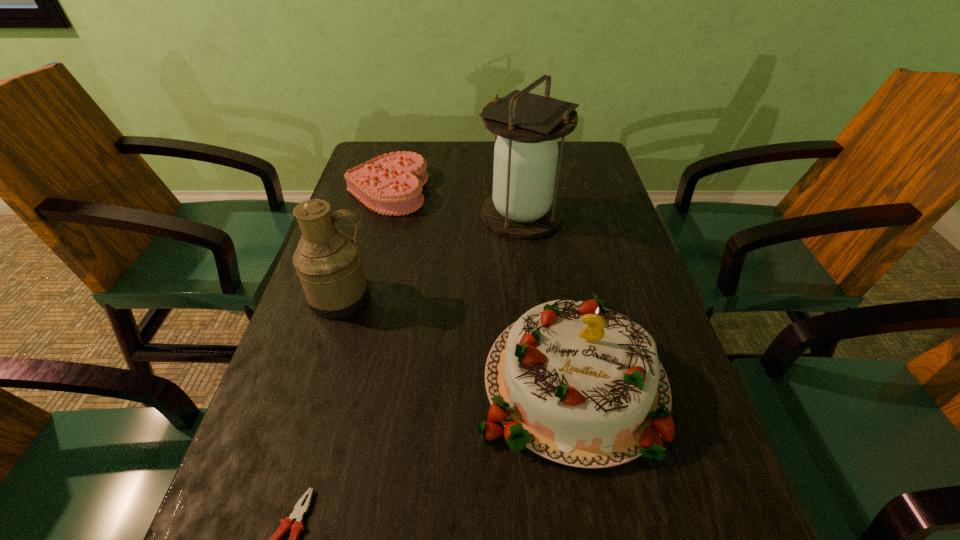
Find the location of a particular element. This screenshot has width=960, height=540. vacant area between the fourth tallest object and the pitcher is located at coordinates (364, 244).

The height and width of the screenshot is (540, 960). Find the location of `free space between the tallest object and the farther cake`. free space between the tallest object and the farther cake is located at coordinates (454, 202).

The height and width of the screenshot is (540, 960). In order to click on free spot between the right cake and the lantern in this screenshot , I will do `click(546, 298)`.

At what (x,y) coordinates should I click in order to perform the action: click on vacant point located between the nearer cake and the lantern. Please return your answer as a coordinate pair (x, y). Image resolution: width=960 pixels, height=540 pixels. Looking at the image, I should click on (546, 298).

At what (x,y) coordinates should I click in order to perform the action: click on unoccupied position between the shorter cake and the lantern. Please return your answer as a coordinate pair (x, y). The width and height of the screenshot is (960, 540). Looking at the image, I should click on (454, 202).

Image resolution: width=960 pixels, height=540 pixels. I want to click on object that is the third closest to the nearest object, so click(x=523, y=205).

Select which object appears as the closest to the lantern. Please provide its 2D coordinates. Your answer should be formatted as a tuple, i.e. [(x, y)], where the tuple contains the x and y coordinates of a point satisfying the conditions above.

[(391, 184)]

Where is `vacant area that satisfies the following two spatial constraints: 1. on the back side of the farther cake; 2. on the right side of the fourth shortest object`? The height and width of the screenshot is (540, 960). vacant area that satisfies the following two spatial constraints: 1. on the back side of the farther cake; 2. on the right side of the fourth shortest object is located at coordinates (373, 191).